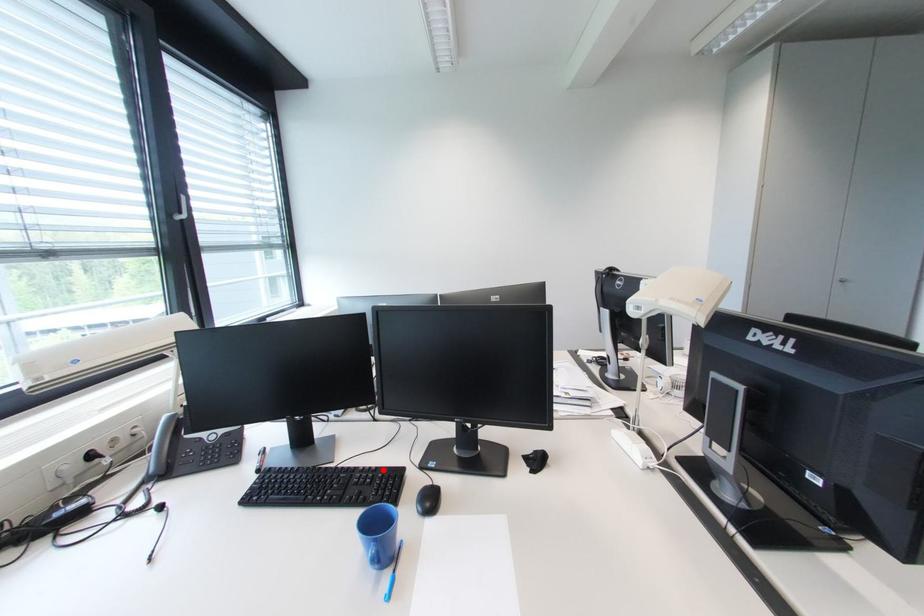
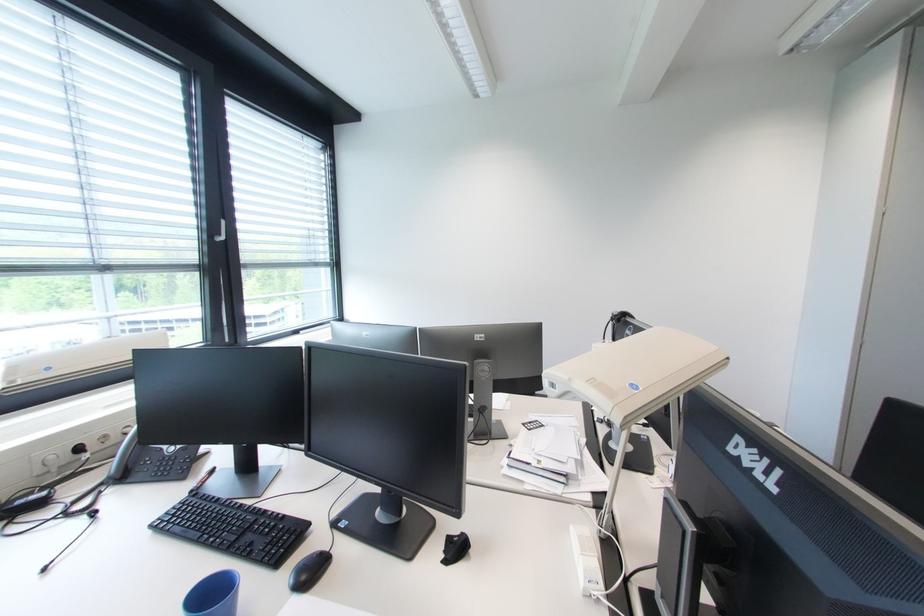
Locate, in the second image, the point that corresponds to the highlighted location in the first image.

(290, 517)